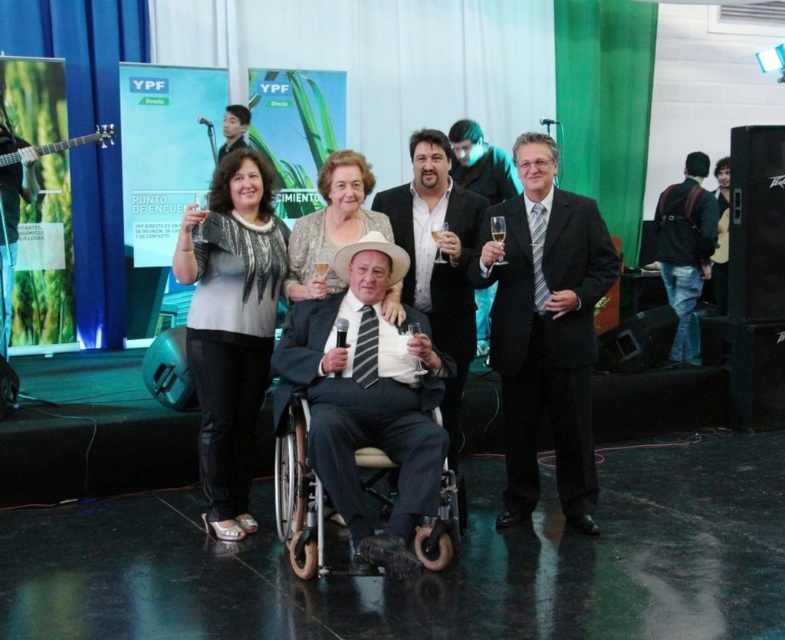
Looking at this image, can you confirm if matte white hat at center is positioned to the left of clear glass champagne flute at center?

Correct, you'll find matte white hat at center to the left of clear glass champagne flute at center.

Who is lower down, matte white hat at center or clear glass champagne flute at center?

Positioned lower is clear glass champagne flute at center.

Is point (351, 204) positioned after point (491, 218)?

Yes, it is.

Where is `matte white hat at center`? This screenshot has width=785, height=640. matte white hat at center is located at coordinates (331, 225).

Who is lower down, metallic silver wheelchair at center or clear glass champagne flute at center?

metallic silver wheelchair at center

Does metallic silver wheelchair at center have a greater width compared to clear glass champagne flute at center?

Yes.

Find the location of a particular element. The height and width of the screenshot is (640, 785). metallic silver wheelchair at center is located at coordinates (298, 492).

Locate an element on the screen. Image resolution: width=785 pixels, height=640 pixels. metallic silver wheelchair at center is located at coordinates (298, 492).

Between striped tie at center and matte black suit at upper center, which one has less height?

Standing shorter between the two is matte black suit at upper center.

Which is in front, point (437, 216) or point (243, 145)?

Point (437, 216)

Which is in front, point (453, 435) or point (239, 141)?

Positioned in front is point (453, 435).

Image resolution: width=785 pixels, height=640 pixels. In order to click on striped tie at center in this screenshot , I will do `click(437, 260)`.